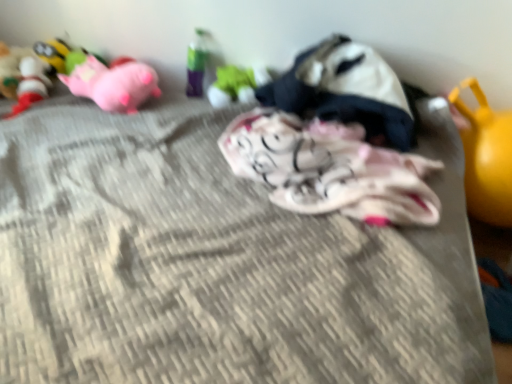
Question: Looking at their shapes, would you say translucent plastic bottle at upper center, which is the fourth toy from left to right, is wider or thinner than textured fabric mattress at center?

Choices:
 (A) thin
 (B) wide

Answer: (A)

Question: From a real-world perspective, is translucent plastic bottle at upper center, which ranks as the 5th toy in right-to-left order, positioned above or below textured fabric mattress at center?

Choices:
 (A) above
 (B) below

Answer: (A)

Question: Estimate the real-world distances between objects in this image. Which object is closer to the textured fabric mattress at center?

Choices:
 (A) pink plush pig at upper left, acting as the third toy starting from the left
 (B) white cotton blanket at center, which is counted as the seventh toy, starting from the left
 (C) translucent plastic bottle at upper center, which is the fourth toy from left to right
 (D) yellow rubber ball at right, the 1th toy viewed from the right
 (E) fluffy white blanket at center, placed as the third toy when sorted from right to left

Answer: (E)

Question: Which is farther from the matte pink plush at upper left, which appears as the 8th toy when viewed from the right?

Choices:
 (A) white cotton blanket at center, the second toy from the right
 (B) textured fabric mattress at center
 (C) green matte toy at center, acting as the fifth toy starting from the left
 (D) translucent plastic bottle at upper center, which ranks as the 5th toy in right-to-left order
 (E) fluffy white blanket at center, placed as the third toy when sorted from right to left

Answer: (E)